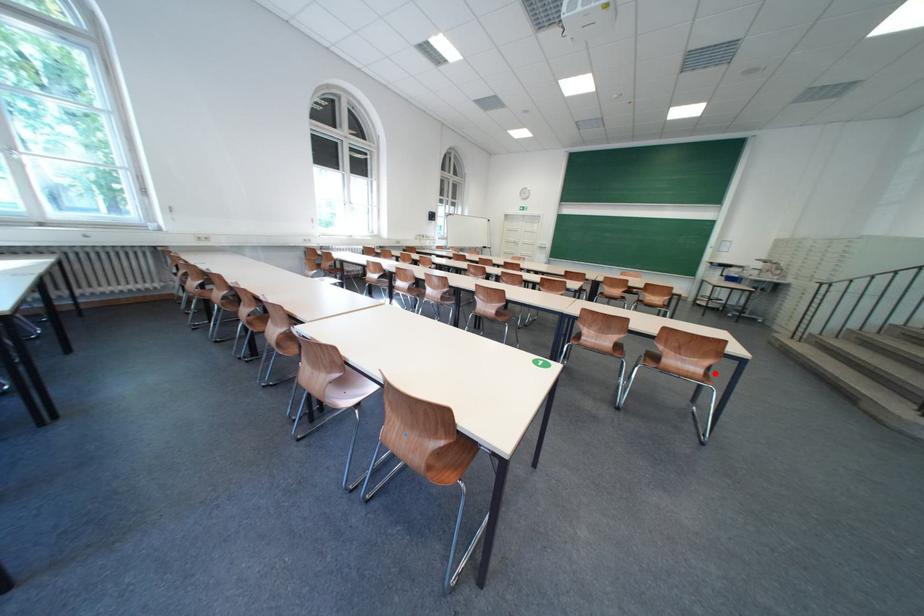
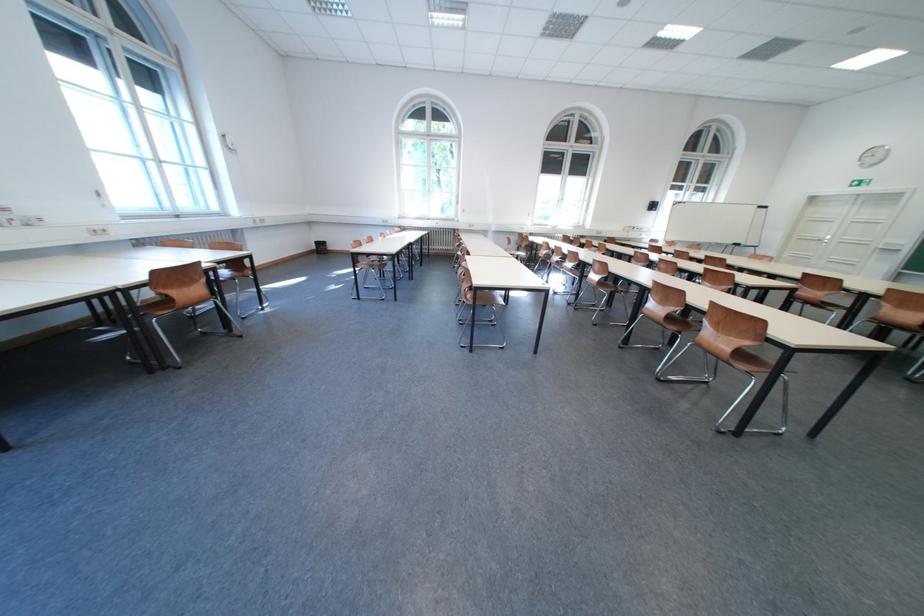
Question: I am providing you with two images of the same scene from different viewpoints. A red point is shown in image1. For the corresponding object point in image2, is it positioned nearer or farther from the camera?

Choices:
 (A) Nearer
 (B) Farther

Answer: (B)